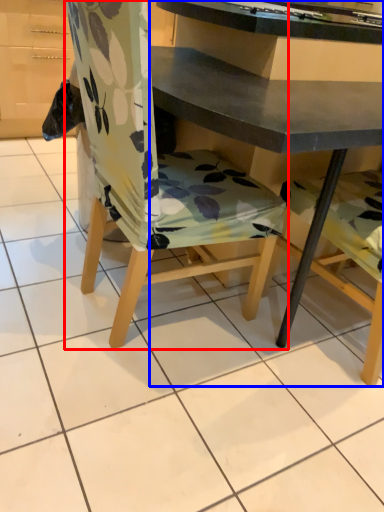
Question: Which of the following is the farthest to the observer, chair (highlighted by a red box) or desk (highlighted by a blue box)?

Choices:
 (A) chair
 (B) desk

Answer: (B)